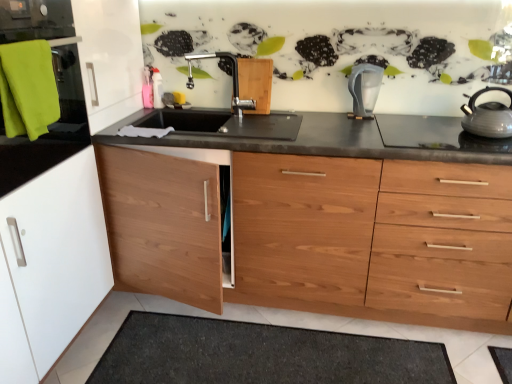
At what (x,y) coordinates should I click in order to perform the action: click on vacant space situated above dark gray textured bath mat at lower center (from a real-world perspective). Please return your answer as a coordinate pair (x, y). This screenshot has height=384, width=512. Looking at the image, I should click on (276, 349).